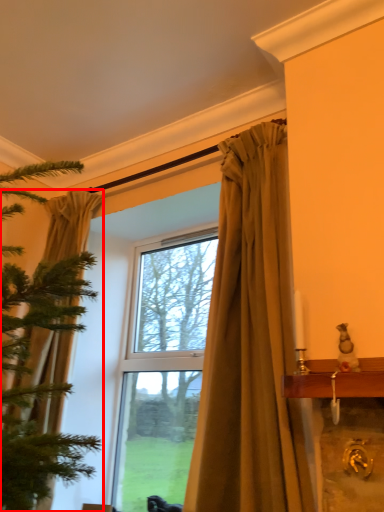
Question: Considering the relative positions of curtain (annotated by the red box) and curtain in the image provided, where is curtain (annotated by the red box) located with respect to the staircase?

Choices:
 (A) left
 (B) right

Answer: (A)